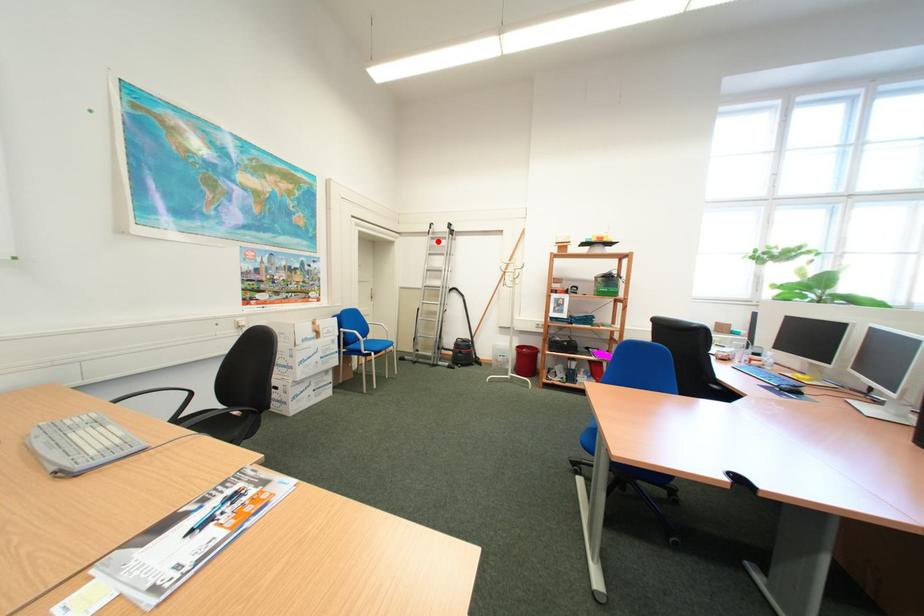
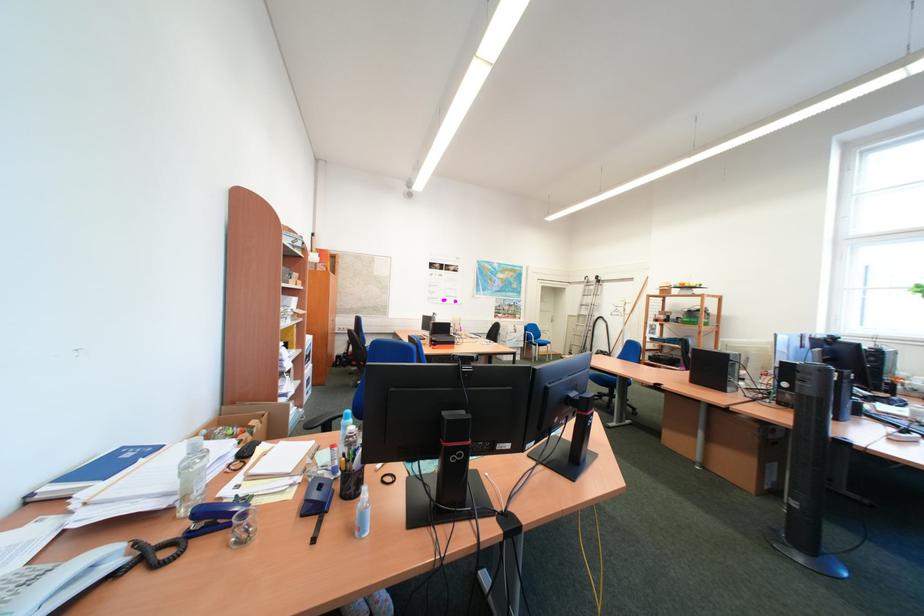
Question: I am providing you with two images of the same scene from different viewpoints. Image1 has a red point marked. In image2, the corresponding 3D location appears at what relative position? Reply with the corresponding letter.

Choices:
 (A) Closer
 (B) Farther

Answer: (B)